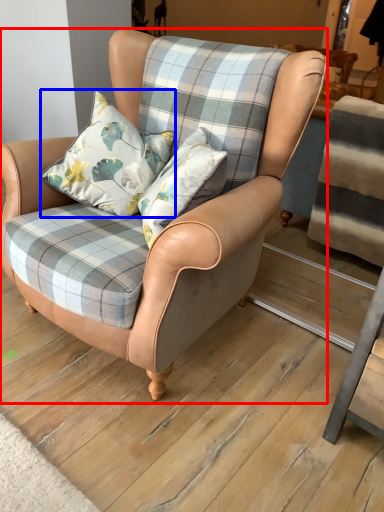
Question: Which of the following is the farthest to the observer, chair (highlighted by a red box) or pillow (highlighted by a blue box)?

Choices:
 (A) chair
 (B) pillow

Answer: (B)